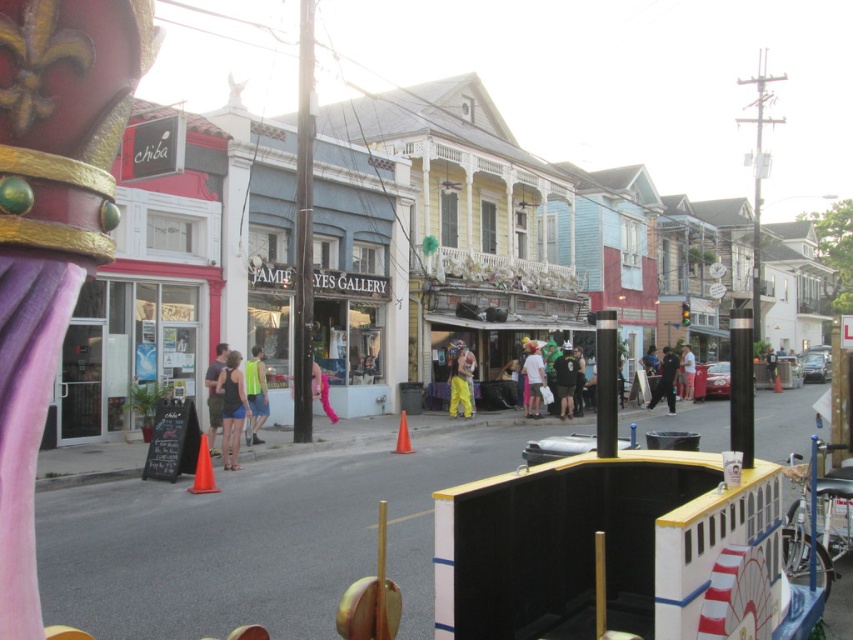
You are a fashion designer observing a street scene with two people wearing the matte black tank top at center and the matte white shirt at center. Which clothing item is more suitable for a summer event considering their sizes?

The matte black tank top at center has a smaller size compared to the matte white shirt at center, so the matte black tank top at center would be more suitable for a summer event as it is lighter and more breathable due to its smaller size.

In the scene shown: You are a tailor observing two pairs of pants displayed in a shop window. The black fabric pants at center and the pink fabric pants at center. Which pair is shorter in height?

The black fabric pants at center is not as tall as pink fabric pants at center, so the black fabric pants at center is shorter in height.